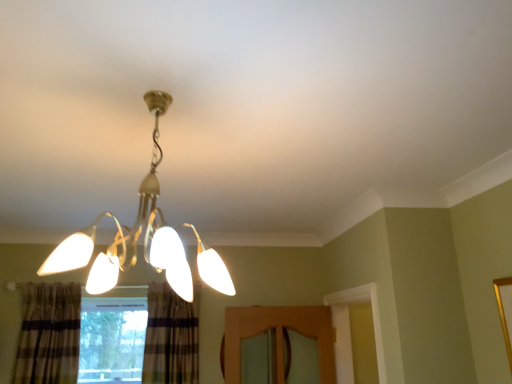
Question: Is matte gold chandelier at center shorter than plaid fabric curtain at lower center, the 2th curtain positioned from the left?

Choices:
 (A) yes
 (B) no

Answer: (A)

Question: From a real-world perspective, is matte gold chandelier at center positioned over plaid fabric curtain at lower center, which is the first curtain from right to left, based on gravity?

Choices:
 (A) no
 (B) yes

Answer: (B)

Question: Considering the relative positions of matte gold chandelier at center and plaid fabric curtain at lower center, the 2th curtain positioned from the left, in the image provided, is matte gold chandelier at center in front of plaid fabric curtain at lower center, the 2th curtain positioned from the left,?

Choices:
 (A) yes
 (B) no

Answer: (A)

Question: Is plaid fabric curtain at lower center, which is the first curtain from right to left, a part of matte gold chandelier at center?

Choices:
 (A) no
 (B) yes

Answer: (A)

Question: Is matte gold chandelier at center further to the viewer compared to plaid fabric curtain at lower center, which is the first curtain from right to left?

Choices:
 (A) yes
 (B) no

Answer: (B)

Question: Which is correct: matte gold chandelier at center is inside clear glass window at lower left, or outside of it?

Choices:
 (A) outside
 (B) inside

Answer: (A)

Question: Looking at the image, does matte gold chandelier at center seem bigger or smaller compared to clear glass window at lower left?

Choices:
 (A) big
 (B) small

Answer: (A)

Question: Considering the relative positions of matte gold chandelier at center and clear glass window at lower left in the image provided, is matte gold chandelier at center to the left or to the right of clear glass window at lower left?

Choices:
 (A) left
 (B) right

Answer: (B)

Question: Is point (108, 284) closer or farther from the camera than point (115, 327)?

Choices:
 (A) closer
 (B) farther

Answer: (A)

Question: From their relative heights in the image, would you say clear glass window at lower left is taller or shorter than matte gold chandelier at center?

Choices:
 (A) short
 (B) tall

Answer: (B)

Question: Considering their positions, is clear glass window at lower left located in front of or behind matte gold chandelier at center?

Choices:
 (A) front
 (B) behind

Answer: (B)

Question: From the image's perspective, is clear glass window at lower left located above or below matte gold chandelier at center?

Choices:
 (A) below
 (B) above

Answer: (A)

Question: Is clear glass window at lower left inside or outside of matte gold chandelier at center?

Choices:
 (A) inside
 (B) outside

Answer: (B)

Question: Considering their positions, is plaid fabric curtain at lower center, which is the first curtain from right to left, located in front of or behind clear glass window at lower left?

Choices:
 (A) front
 (B) behind

Answer: (A)

Question: From their relative heights in the image, would you say plaid fabric curtain at lower center, which is the first curtain from right to left, is taller or shorter than clear glass window at lower left?

Choices:
 (A) tall
 (B) short

Answer: (A)